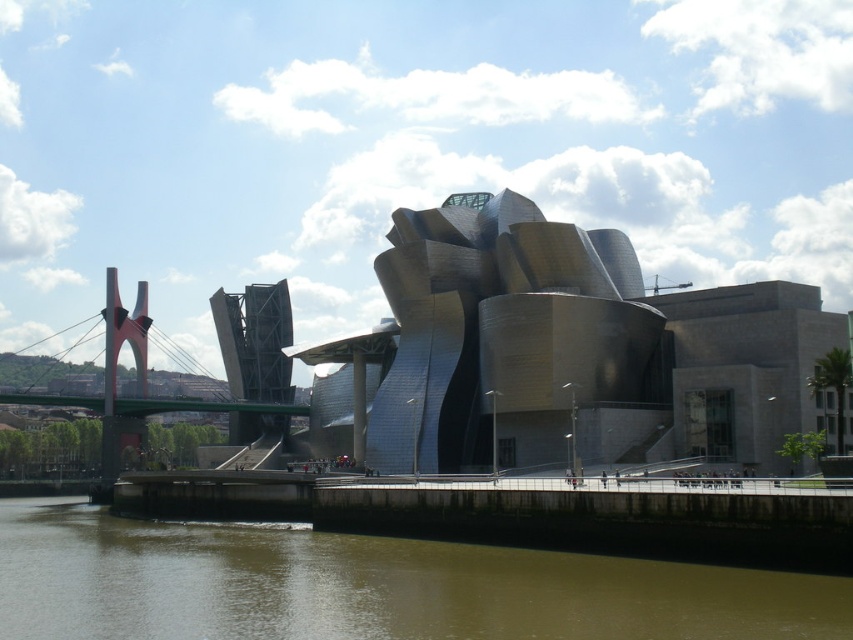
The width and height of the screenshot is (853, 640). What do you see at coordinates (369, 586) in the screenshot? I see `brown sedimentary water at lower center` at bounding box center [369, 586].

Looking at this image, is brown sedimentary water at lower center smaller than green metallic bridge at left?

Correct, brown sedimentary water at lower center occupies less space than green metallic bridge at left.

Is point (300, 609) closer to viewer compared to point (190, 464)?

Yes, point (300, 609) is in front of point (190, 464).

Locate an element on the screen. The height and width of the screenshot is (640, 853). brown sedimentary water at lower center is located at coordinates (369, 586).

Between metallic silver building at center and green metallic bridge at left, which one is positioned higher?

Positioned higher is metallic silver building at center.

Does metallic silver building at center have a larger size compared to green metallic bridge at left?

Actually, metallic silver building at center might be smaller than green metallic bridge at left.

Identify the location of metallic silver building at center. This screenshot has height=640, width=853. (564, 353).

I want to click on metallic silver building at center, so click(x=564, y=353).

Is point (625, 243) more distant than point (679, 586)?

Yes, it is.

Which is behind, point (604, 417) or point (102, 513)?

The point (102, 513) is more distant.

You are a GUI agent. You are given a task and a screenshot of the screen. Output one action in this format:
    pyautogui.click(x=<x>, y=<y>)
    Task: Click on the metallic silver building at center
    The height and width of the screenshot is (640, 853).
    Given the screenshot: What is the action you would take?
    pyautogui.click(x=564, y=353)